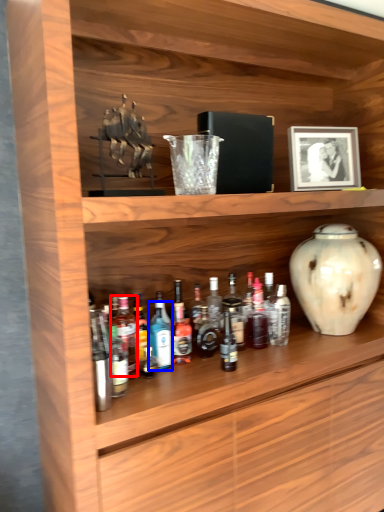
Question: Which of the following is the closest to the observer, bottle (highlighted by a red box) or bottle (highlighted by a blue box)?

Choices:
 (A) bottle
 (B) bottle

Answer: (A)